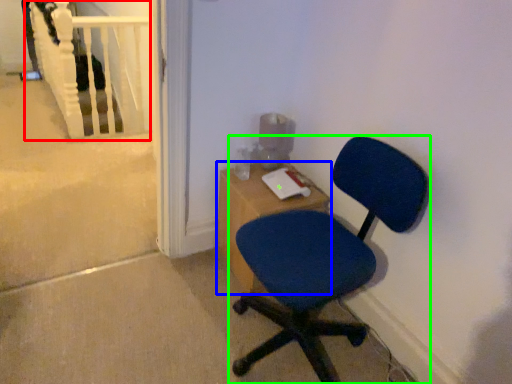
Question: Estimate the real-world distances between objects in this image. Which object is closer to rail (highlighted by a red box), desk (highlighted by a blue box) or chair (highlighted by a green box)?

Choices:
 (A) desk
 (B) chair

Answer: (A)